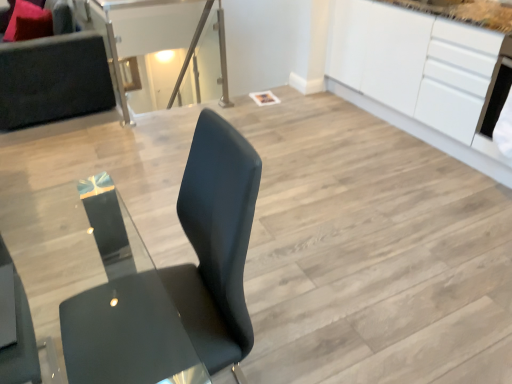
Question: Does white glossy cabinetry at upper right have a greater width compared to matte black chair at lower left, the second chair positioned from the bottom?

Choices:
 (A) no
 (B) yes

Answer: (B)

Question: From a real-world perspective, is white glossy cabinetry at upper right under matte black chair at lower left, the first chair in the top-to-bottom sequence?

Choices:
 (A) yes
 (B) no

Answer: (A)

Question: Considering the relative sizes of white glossy cabinetry at upper right and matte black chair at lower left, the first chair in the top-to-bottom sequence, in the image provided, is white glossy cabinetry at upper right taller than matte black chair at lower left, the first chair in the top-to-bottom sequence,?

Choices:
 (A) yes
 (B) no

Answer: (A)

Question: Does white glossy cabinetry at upper right come in front of matte black chair at lower left, the second chair positioned from the bottom?

Choices:
 (A) yes
 (B) no

Answer: (B)

Question: From a real-world perspective, is white glossy cabinetry at upper right on top of matte black chair at lower left, the second chair positioned from the bottom?

Choices:
 (A) no
 (B) yes

Answer: (A)

Question: Choose the correct answer: Is velvet pink pillow at upper left inside white glossy cabinetry at upper right or outside it?

Choices:
 (A) inside
 (B) outside

Answer: (B)

Question: From a real-world perspective, is velvet pink pillow at upper left above or below white glossy cabinetry at upper right?

Choices:
 (A) below
 (B) above

Answer: (B)

Question: From their relative heights in the image, would you say velvet pink pillow at upper left is taller or shorter than white glossy cabinetry at upper right?

Choices:
 (A) short
 (B) tall

Answer: (A)

Question: Is point (38, 18) positioned closer to the camera than point (481, 54)?

Choices:
 (A) farther
 (B) closer

Answer: (A)

Question: From a real-world perspective, is dark gray fabric couch at upper left physically located above or below velvet pink pillow at upper left?

Choices:
 (A) below
 (B) above

Answer: (A)

Question: In the image, is dark gray fabric couch at upper left positioned in front of or behind velvet pink pillow at upper left?

Choices:
 (A) behind
 (B) front

Answer: (B)

Question: From the image's perspective, is dark gray fabric couch at upper left located above or below velvet pink pillow at upper left?

Choices:
 (A) above
 (B) below

Answer: (B)

Question: Considering the positions of dark gray fabric couch at upper left and velvet pink pillow at upper left in the image, is dark gray fabric couch at upper left wider or thinner than velvet pink pillow at upper left?

Choices:
 (A) wide
 (B) thin

Answer: (A)

Question: Looking at their shapes, would you say velvet pink pillow at upper left is wider or thinner than matte black chair at lower left, the first chair in the top-to-bottom sequence?

Choices:
 (A) wide
 (B) thin

Answer: (A)

Question: Does point (16, 28) appear closer or farther from the camera than point (28, 355)?

Choices:
 (A) closer
 (B) farther

Answer: (B)